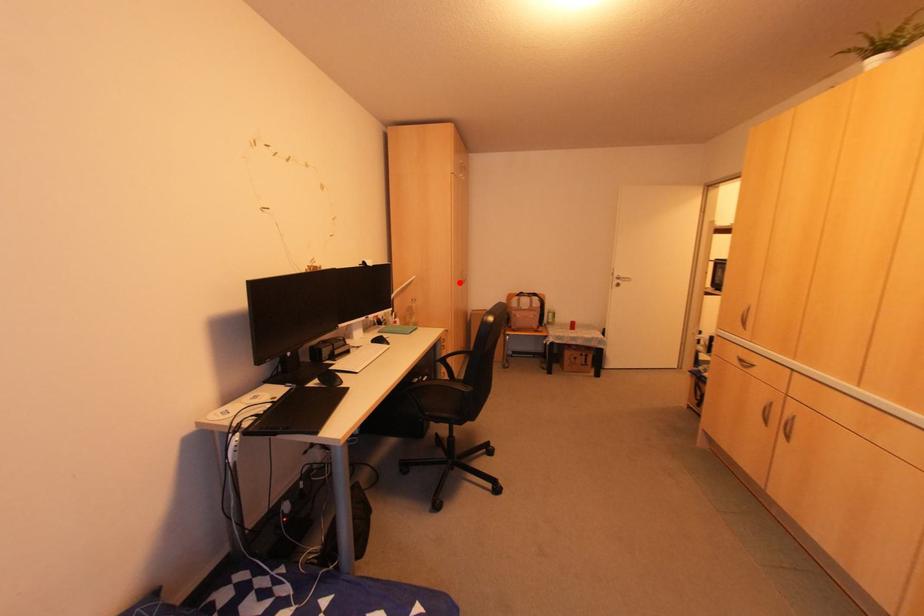
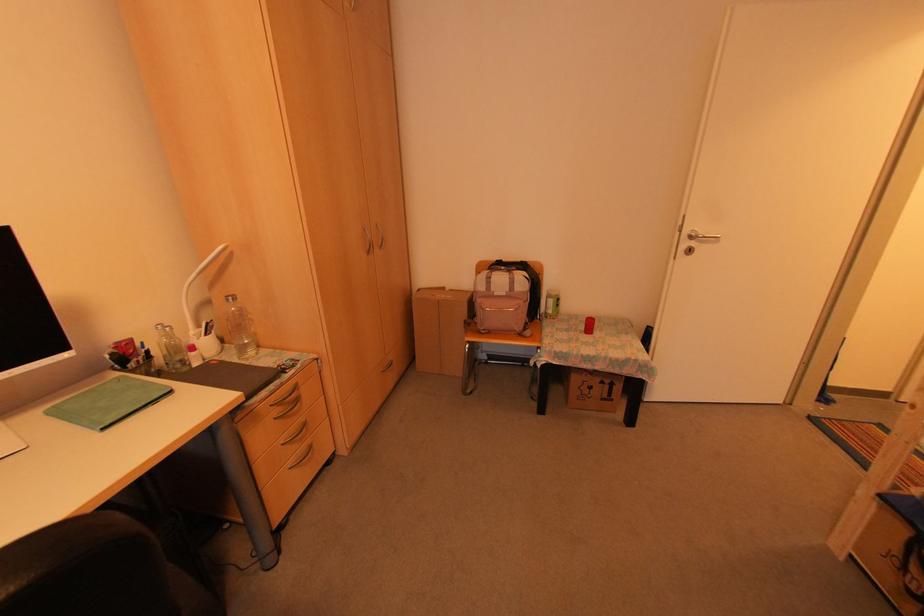
Find the pixel in the second image that matches the highlighted location in the first image.

(366, 249)